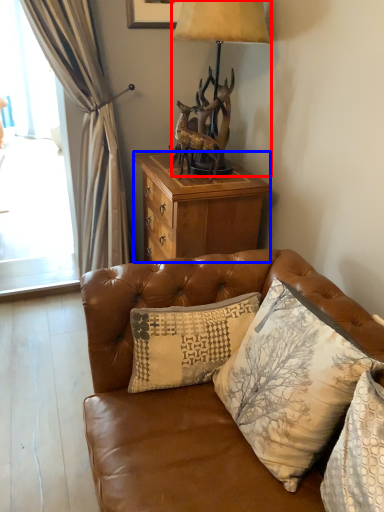
Question: Which point is further to the camera, lamp (highlighted by a red box) or desk (highlighted by a blue box)?

Choices:
 (A) lamp
 (B) desk

Answer: (B)